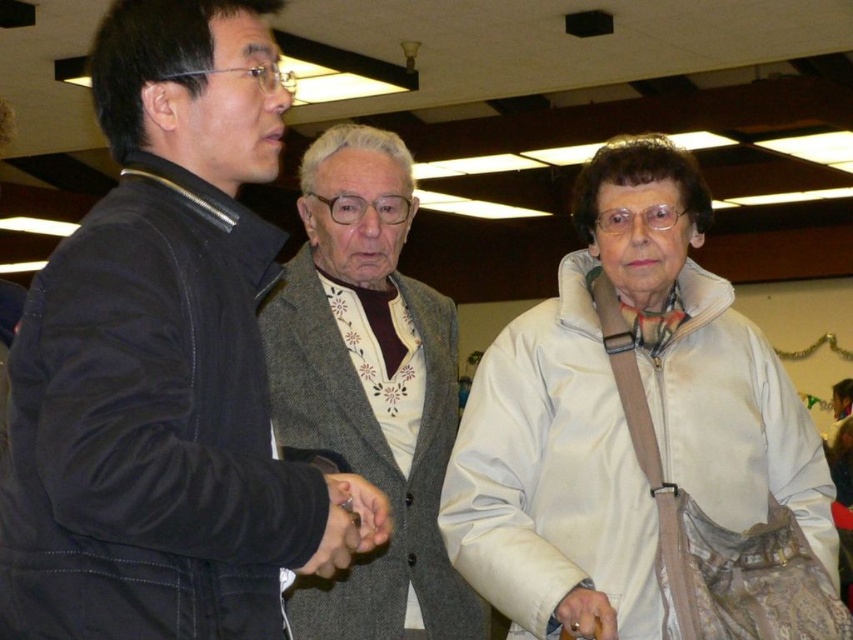
You are a photographer setting up for a group photo. You notice the white fabric jacket at center and the gray wool sweater at center. Which clothing item is positioned lower on the person?

The white fabric jacket at center is below gray wool sweater at center, so the white fabric jacket at center is positioned lower.

You are trying to decide which jacket to wear for a cold day. You have the black leather jacket at left and the white fabric jacket at center. Based on their thickness, which one would provide better insulation?

The white fabric jacket at center is thicker than the black leather jacket at left, so it would provide better insulation.

You are organizing a clothing donation drive and need to categorize items by size. You have two items to sort today. The first is the black leather jacket at left, and the second is the gray wool sweater at center. Based on their sizes, which item should be placed in the medium size bin?

The black leather jacket at left has a smaller size compared to gray wool sweater at center, so the black leather jacket at left should be placed in the medium size bin if the gray wool sweater at center is considered large. However, without knowing the exact size standards, it can be inferred that the smaller black leather jacket at left would fit better in the medium bin compared to the larger gray wool sweater at center.